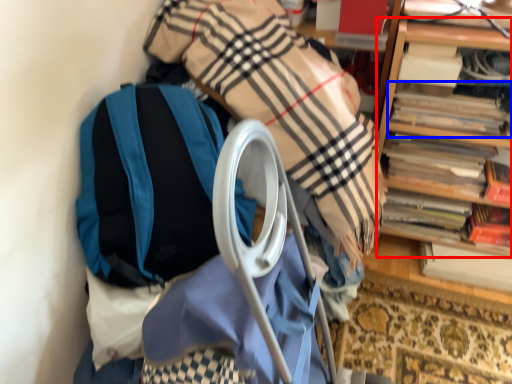
Question: Among these objects, which one is nearest to the camera, shelf (highlighted by a red box) or book (highlighted by a blue box)?

Choices:
 (A) shelf
 (B) book

Answer: (A)